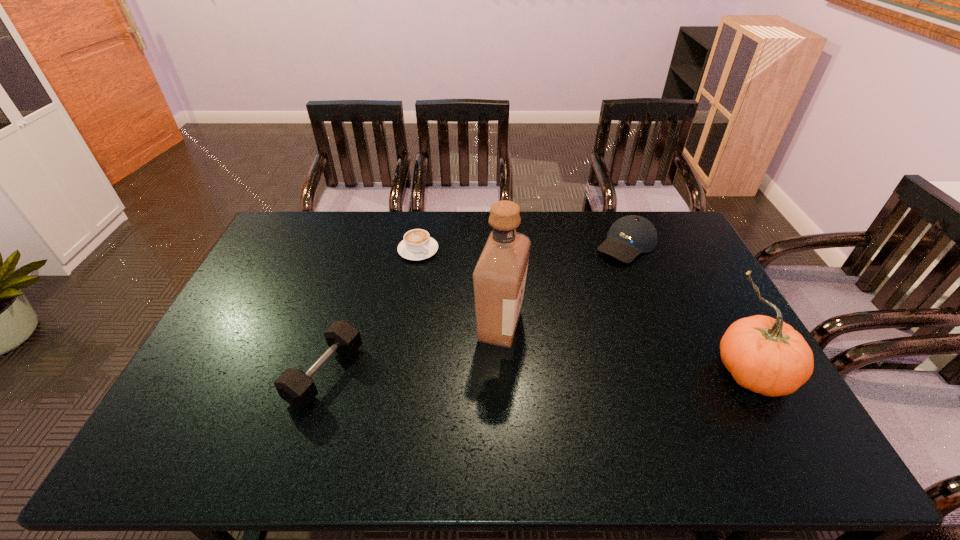
Locate an element on the screen. Image resolution: width=960 pixels, height=540 pixels. free region that satisfies the following two spatial constraints: 1. on the back side of the baseball cap; 2. on the right side of the leftmost object is located at coordinates (366, 245).